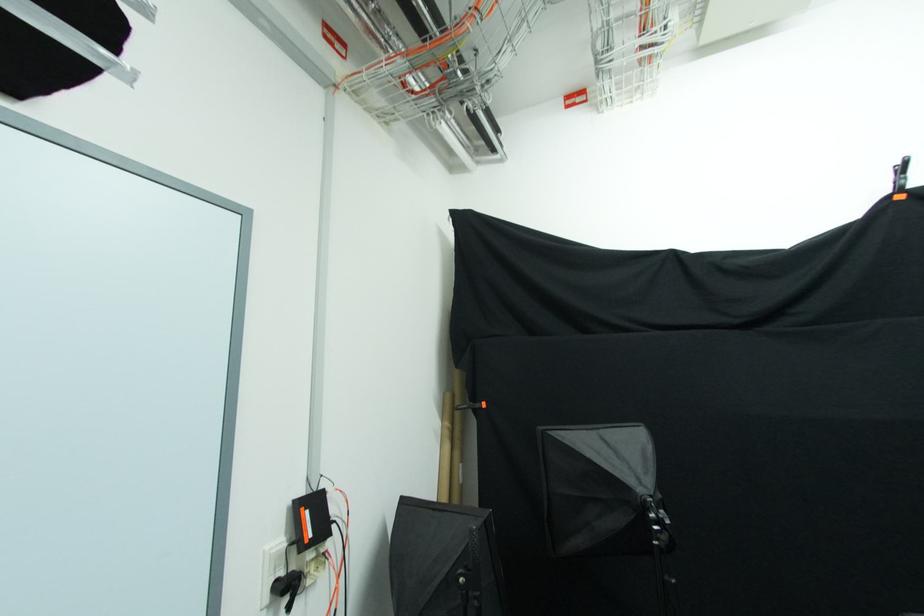
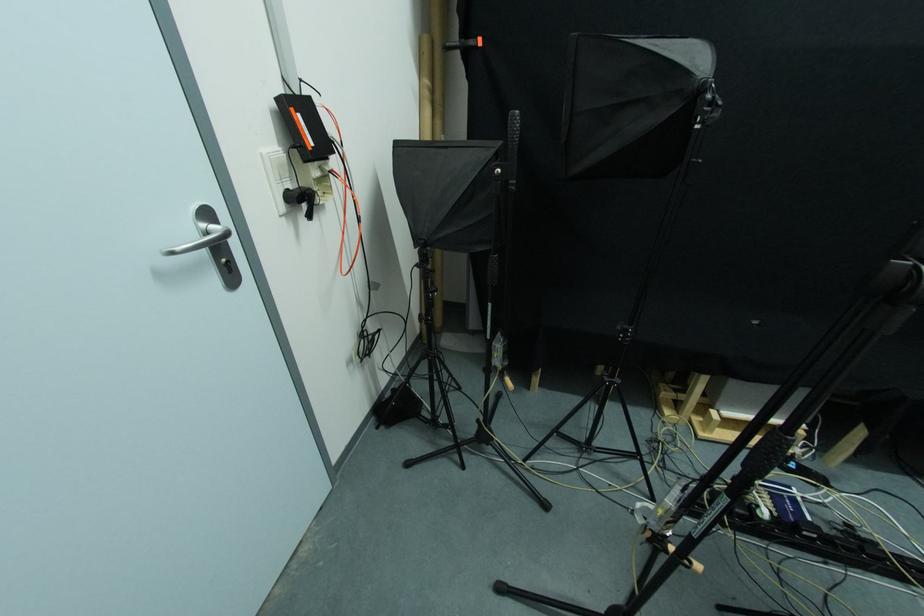
The point at (285, 577) is marked in the first image. Where is the corresponding point in the second image?

(292, 188)